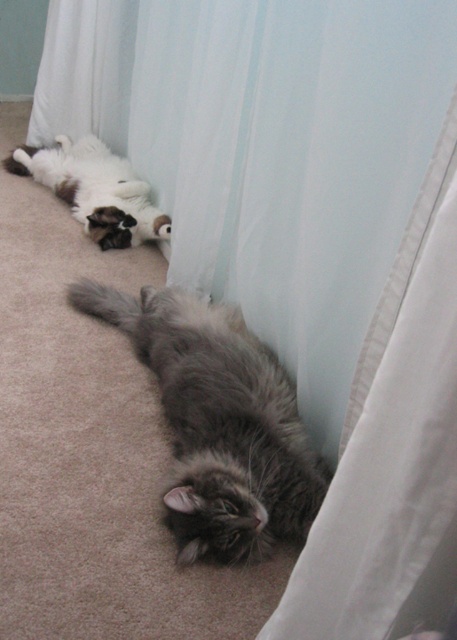
Which is above, gray tabby cat at center or fluffy white cat at upper left?

fluffy white cat at upper left

Where is `gray tabby cat at center`? Image resolution: width=457 pixels, height=640 pixels. gray tabby cat at center is located at coordinates (219, 422).